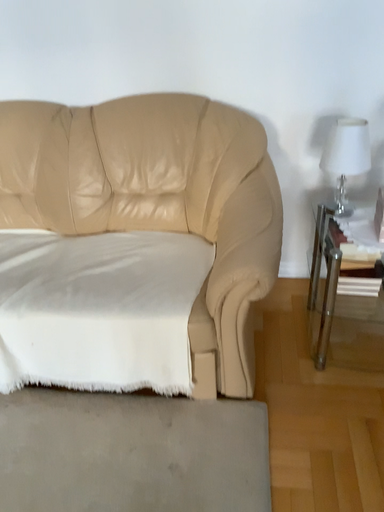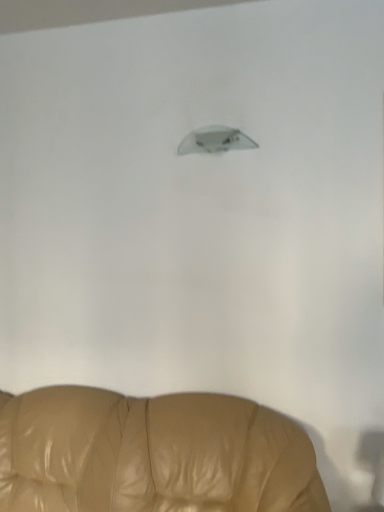
Question: Which way did the camera rotate in the video?

Choices:
 (A) rotated downward
 (B) rotated upward

Answer: (B)